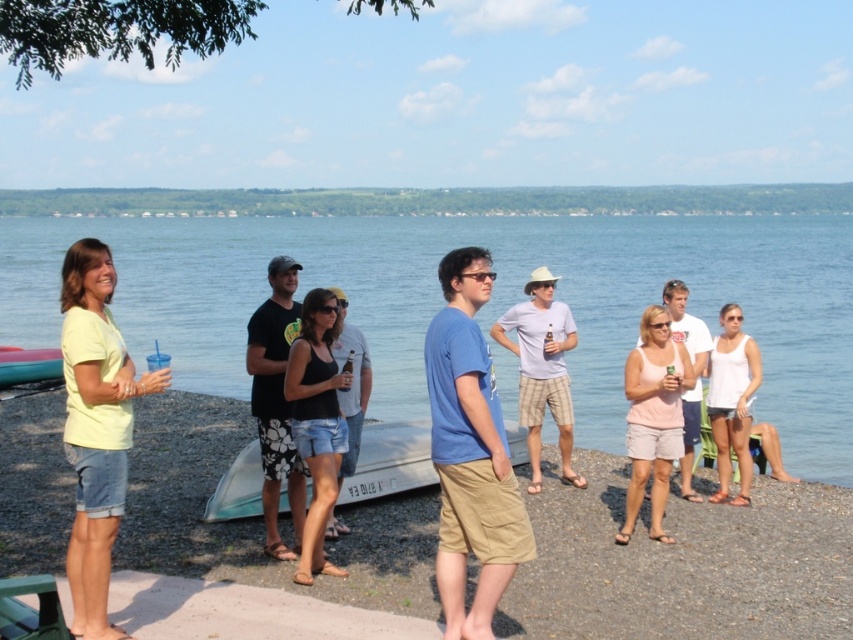
Question: Which object appears farthest from the camera in this image?

Choices:
 (A) blue cotton shirt at center
 (B) matte black tank top at center
 (C) black cotton t-shirt at center
 (D) blue water at center

Answer: (D)

Question: From the image, what is the correct spatial relationship of light gray cotton t-shirt at center in relation to translucent plastic kayak at lower left?

Choices:
 (A) right
 (B) left

Answer: (A)

Question: Is white cotton tank top at center-right in front of pink cotton tank top at center?

Choices:
 (A) yes
 (B) no

Answer: (B)

Question: Which point appears farthest from the camera in this image?

Choices:
 (A) (631, 476)
 (B) (341, 312)
 (C) (306, 547)
 (D) (32, 349)

Answer: (D)

Question: From the image, what is the correct spatial relationship of yellow matte shirt at center in relation to black denim shorts at center?

Choices:
 (A) below
 (B) above

Answer: (A)

Question: Which is nearer to the matte black tank top at center?

Choices:
 (A) white cotton tank top at center-right
 (B) black cotton t-shirt at center
 (C) light gray cotton t-shirt at center
 (D) pink fabric tank top at center

Answer: (B)